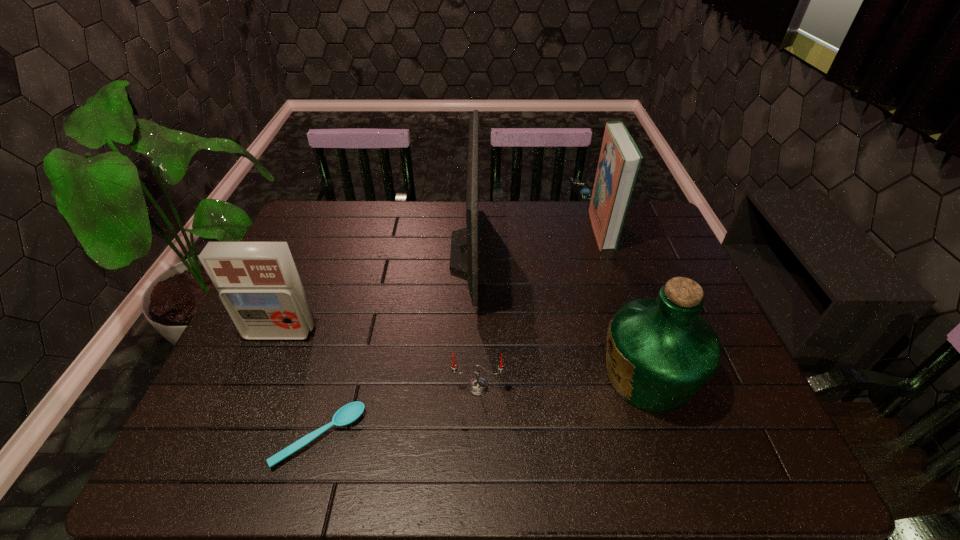
Locate an element on the screen. This screenshot has height=540, width=960. monitor is located at coordinates (468, 246).

Identify the location of hardback book. (x=620, y=159).

Find the location of a particular element. Image resolution: width=960 pixels, height=540 pixels. liquor is located at coordinates (660, 351).

Locate an element on the screen. The height and width of the screenshot is (540, 960). the leftmost object is located at coordinates (258, 283).

Locate an element on the screen. The image size is (960, 540). candle is located at coordinates (477, 386).

The image size is (960, 540). Find the location of `the shortest object`. the shortest object is located at coordinates (349, 413).

Find the location of `spoon`. spoon is located at coordinates (349, 413).

At what (x,y) coordinates should I click in order to perform the action: click on vacant region located 0.390m on the screen side of the monitor. Please return your answer as a coordinate pair (x, y). The height and width of the screenshot is (540, 960). Looking at the image, I should click on (611, 252).

Locate an element on the screen. The height and width of the screenshot is (540, 960). vacant space located 0.270m on the cover of the hardback book is located at coordinates (511, 229).

You are a GUI agent. You are given a task and a screenshot of the screen. Output one action in this format:
    pyautogui.click(x=<x>, y=<y>)
    Task: Click on the vacant space situated 0.120m on the cover of the hardback book
    The width and height of the screenshot is (960, 540).
    Given the screenshot: What is the action you would take?
    pyautogui.click(x=556, y=229)